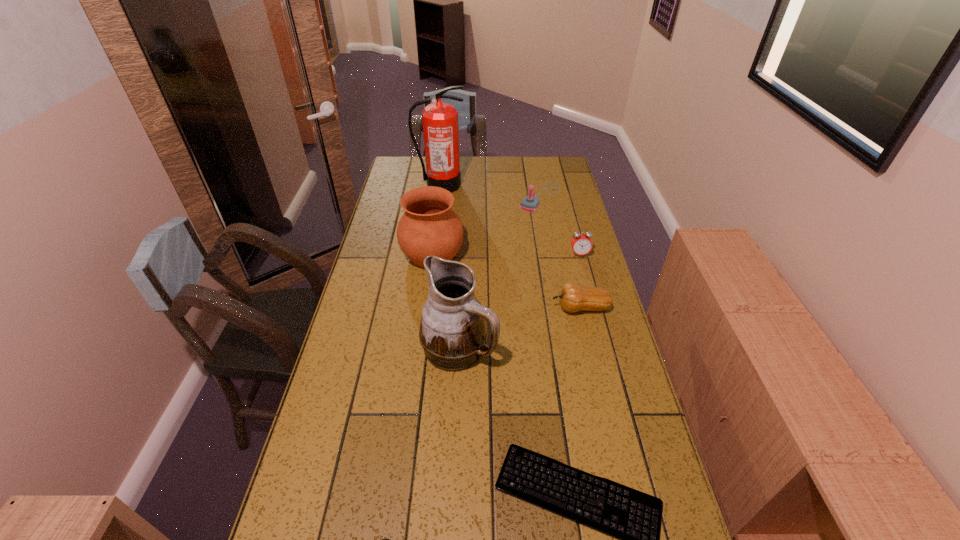
The width and height of the screenshot is (960, 540). In order to click on fire extinguisher in this screenshot , I will do `click(440, 120)`.

Find the location of a particular element. The height and width of the screenshot is (540, 960). pitcher is located at coordinates (453, 332).

At what (x,y) coordinates should I click in order to perform the action: click on the sixth farthest object. Please return your answer as a coordinate pair (x, y). This screenshot has width=960, height=540. Looking at the image, I should click on (453, 332).

This screenshot has width=960, height=540. Identify the location of pottery. (429, 226).

You are a GUI agent. You are given a task and a screenshot of the screen. Output one action in this format:
    pyautogui.click(x=<x>, y=<y>)
    Task: Click on the joystick
    This screenshot has height=540, width=960.
    Given the screenshot: What is the action you would take?
    coord(530,203)

Locate an element on the screen. gourd is located at coordinates (573, 297).

This screenshot has width=960, height=540. Find the location of `alarm clock`. alarm clock is located at coordinates (581, 244).

At what (x,y) coordinates should I click in order to perform the action: click on free spot located 0.250m on the front side of the tallest object. Please return your answer as a coordinate pair (x, y). Looking at the image, I should click on (435, 227).

Where is `vacant space located 0.140m from the spout of the second tallest object`? The height and width of the screenshot is (540, 960). vacant space located 0.140m from the spout of the second tallest object is located at coordinates (545, 348).

Locate an element on the screen. This screenshot has height=540, width=960. free region located 0.350m on the back of the third tallest object is located at coordinates (441, 189).